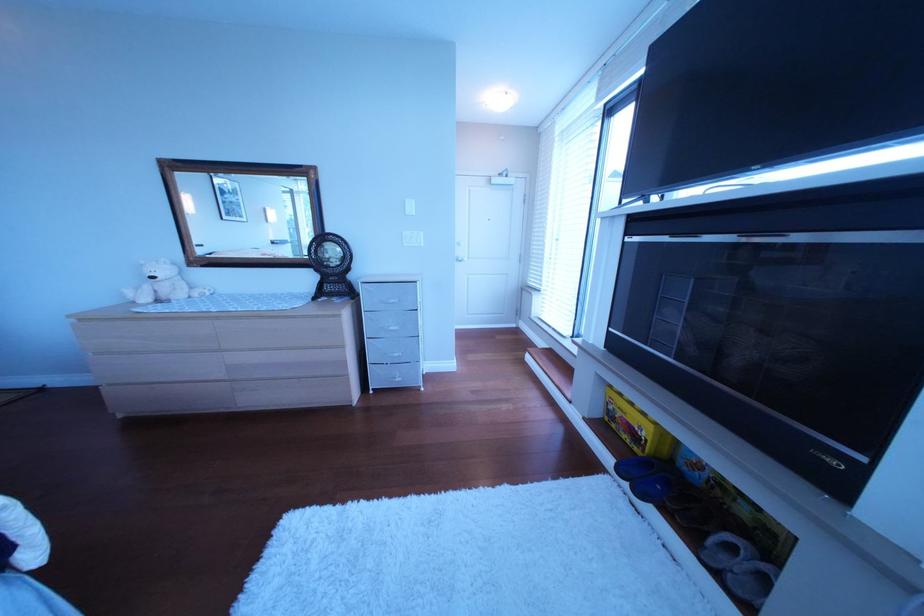
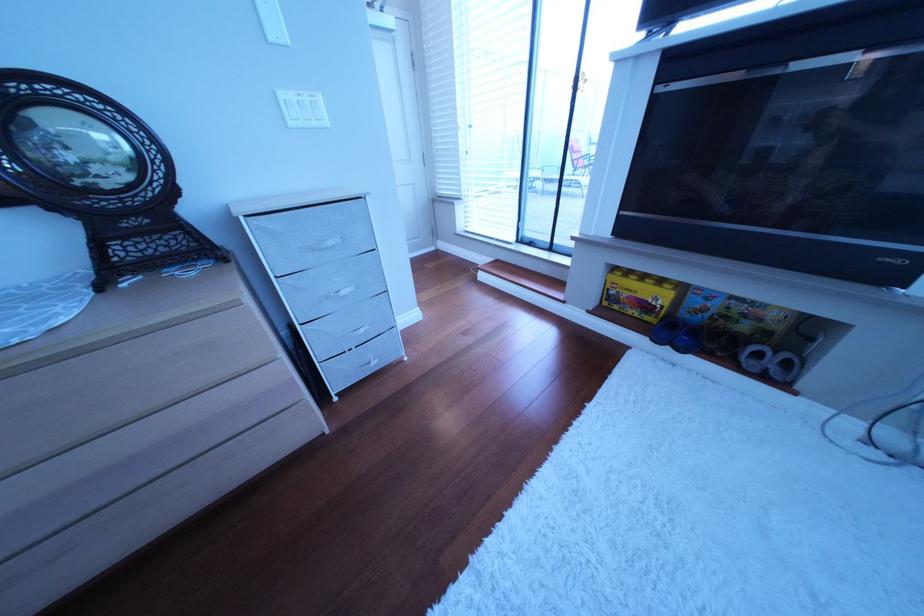
The point at (636, 474) is marked in the first image. Where is the corresponding point in the second image?

(673, 342)